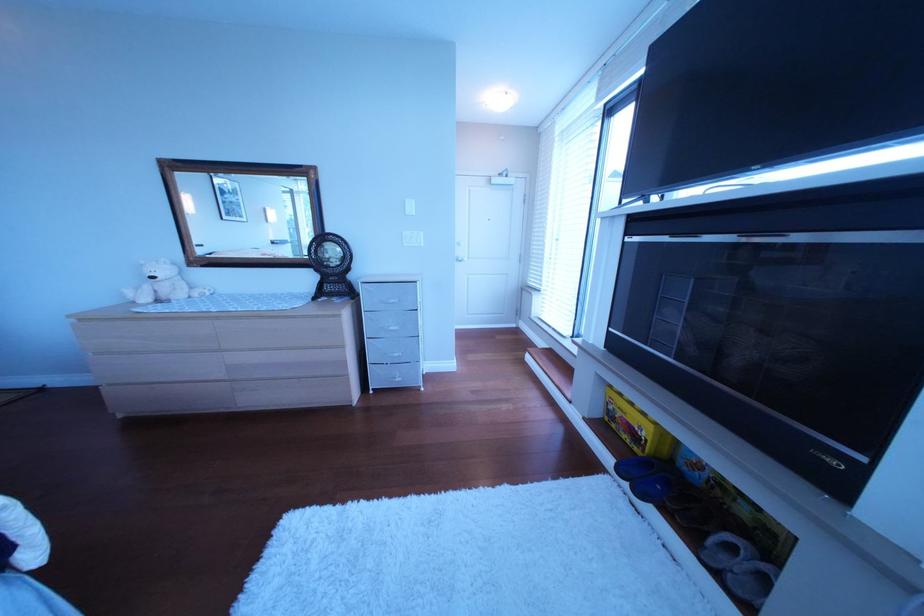
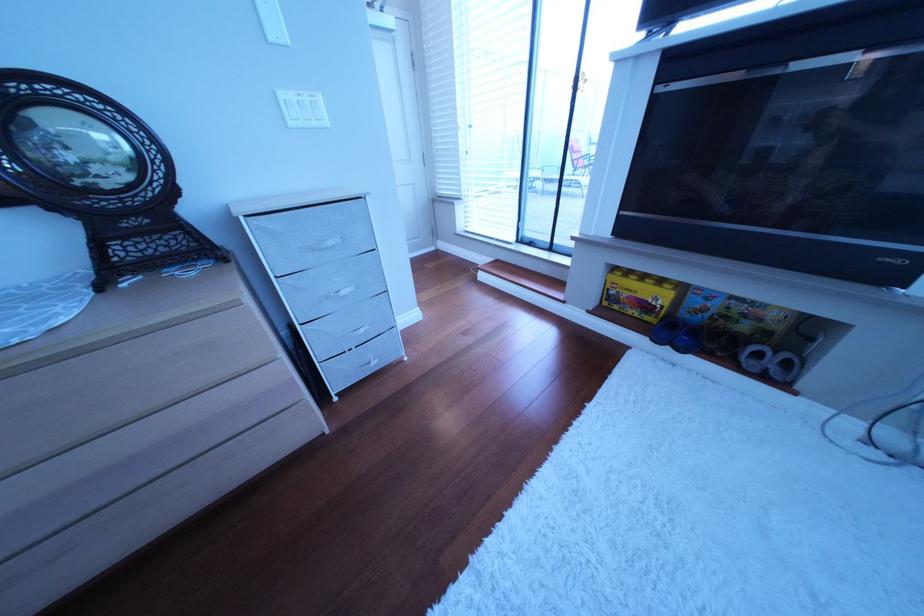
The point at (636, 474) is marked in the first image. Where is the corresponding point in the second image?

(673, 342)